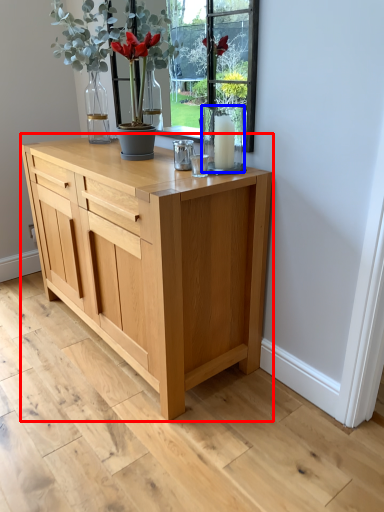
Question: Among these objects, which one is nearest to the camera, chest of drawers (highlighted by a red box) or glass vase (highlighted by a blue box)?

Choices:
 (A) chest of drawers
 (B) glass vase

Answer: (A)